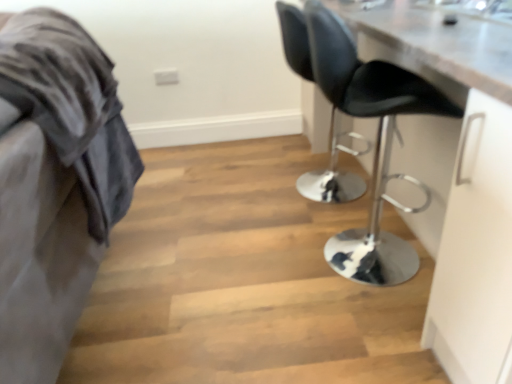
Question: Considering the positions of velvet grey blanket at left and black leather chair at right, which appears as the 2th chair when viewed from the back, in the image, is velvet grey blanket at left wider or thinner than black leather chair at right, which appears as the 2th chair when viewed from the back,?

Choices:
 (A) thin
 (B) wide

Answer: (B)

Question: From a real-world perspective, is velvet grey blanket at left positioned above or below black leather chair at right, which appears as the 2th chair when viewed from the back?

Choices:
 (A) below
 (B) above

Answer: (A)

Question: Which object is the farthest from the black leather chair at center, which ranks as the 2th chair in front-to-back order?

Choices:
 (A) black leather chair at right, which appears as the 2th chair when viewed from the back
 (B) velvet grey blanket at left

Answer: (B)

Question: Considering the real-world distances, which object is closest to the black leather chair at center, the first chair when ordered from back to front?

Choices:
 (A) black leather chair at right, which appears as the 2th chair when viewed from the back
 (B) velvet grey blanket at left

Answer: (A)